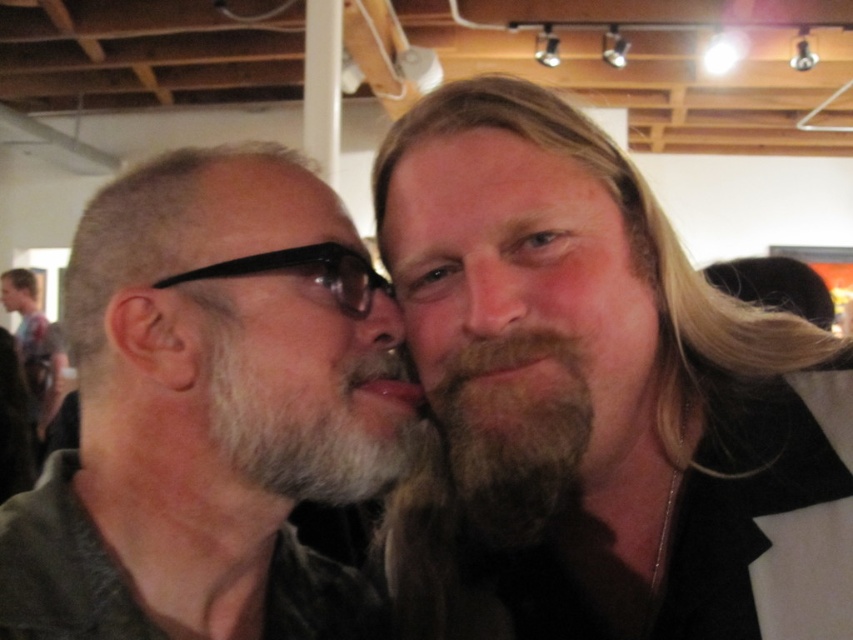
Can you confirm if dark brown hair at center is taller than dark brown fuzzy beard at center?

Yes, dark brown hair at center is taller than dark brown fuzzy beard at center.

Who is more forward, (x=409, y=202) or (x=567, y=392)?

Positioned in front is point (x=567, y=392).

What do you see at coordinates (529, 284) in the screenshot? I see `dark brown hair at center` at bounding box center [529, 284].

Image resolution: width=853 pixels, height=640 pixels. I want to click on dark brown hair at center, so click(x=529, y=284).

In the scene shown: Does dark brown hair at center come behind gray matte beard at center?

That is False.

Between point (398, 227) and point (22, 300), which one is positioned behind?

Point (22, 300)

Is point (482, 314) positioned after point (27, 305)?

No, (482, 314) is in front of (27, 305).

I want to click on dark brown hair at center, so click(529, 284).

Is white fuzzy beard at center to the left of smooth skin nose at center from the viewer's perspective?

Indeed, white fuzzy beard at center is positioned on the left side of smooth skin nose at center.

You are a GUI agent. You are given a task and a screenshot of the screen. Output one action in this format:
    pyautogui.click(x=<x>, y=<y>)
    Task: Click on the white fuzzy beard at center
    
    Given the screenshot: What is the action you would take?
    pyautogui.click(x=312, y=412)

Is point (265, 353) farther from camera compared to point (393, 292)?

No, it is not.

Identify the location of white fuzzy beard at center. Image resolution: width=853 pixels, height=640 pixels. (312, 412).